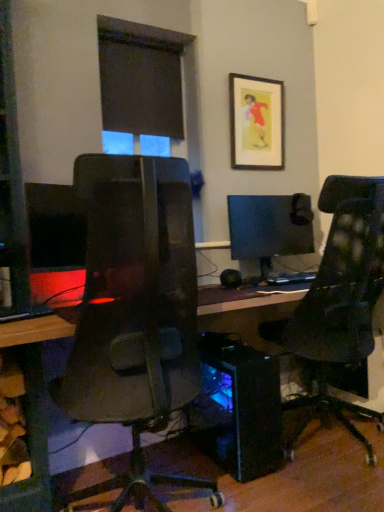
I want to click on free location in front of transparent blue computer tower at center, so click(239, 493).